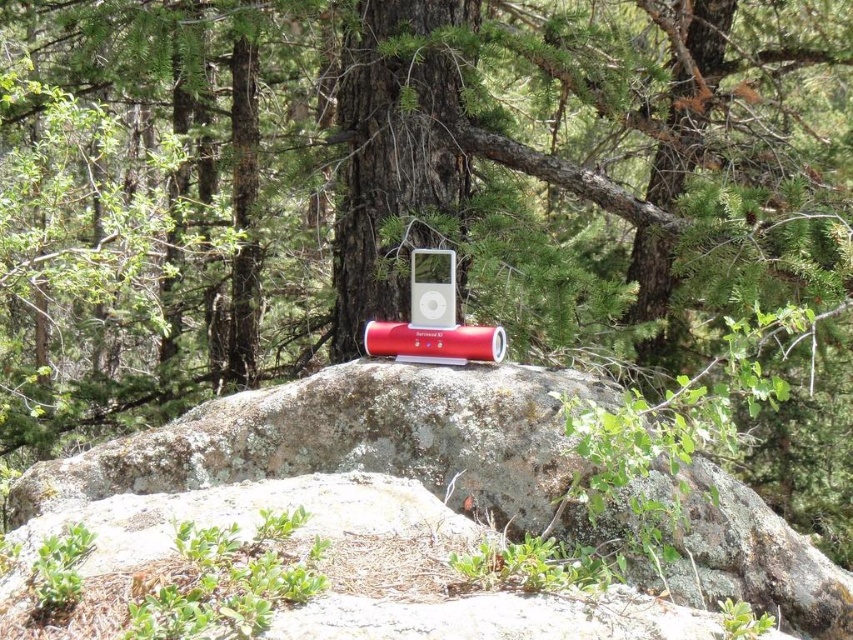
From the picture: You are standing in front of the large rock in the forest. There are two points marked on the rock. One is at coordinates point (383, 348) and the other is at point (439, 289). Which point is closer to you?

Point (383, 348) is further to the camera than point (439, 289), so the point closer to you is point (439, 289).